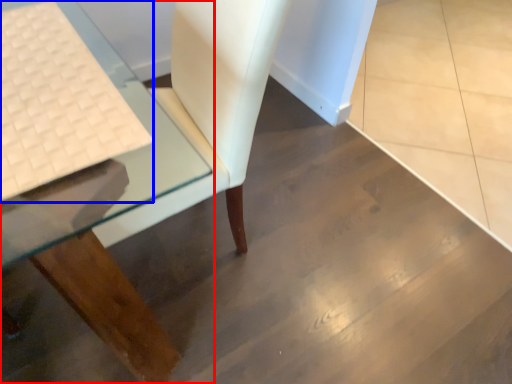
Question: Which point is further to the camera, table (highlighted by a red box) or laptop keyboard (highlighted by a blue box)?

Choices:
 (A) table
 (B) laptop keyboard

Answer: (B)